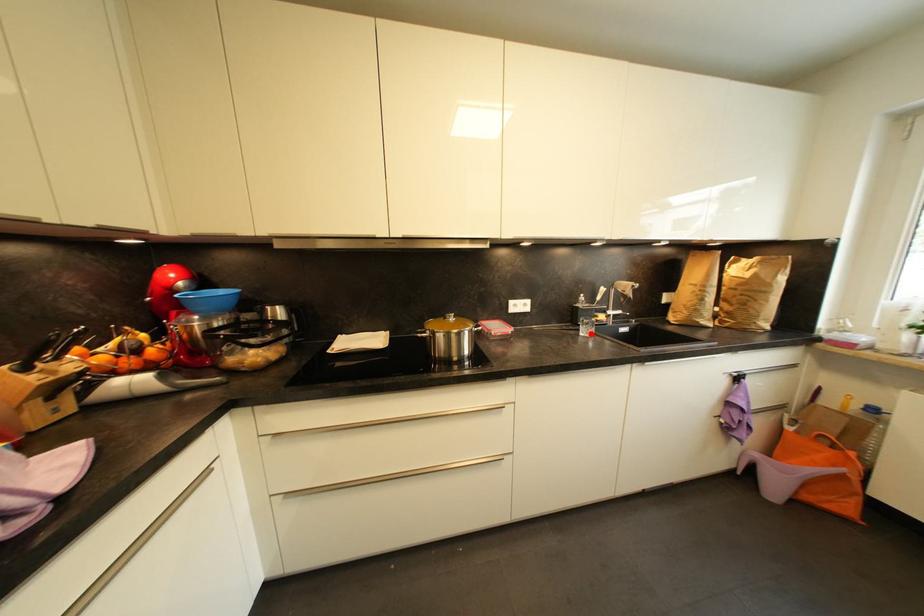
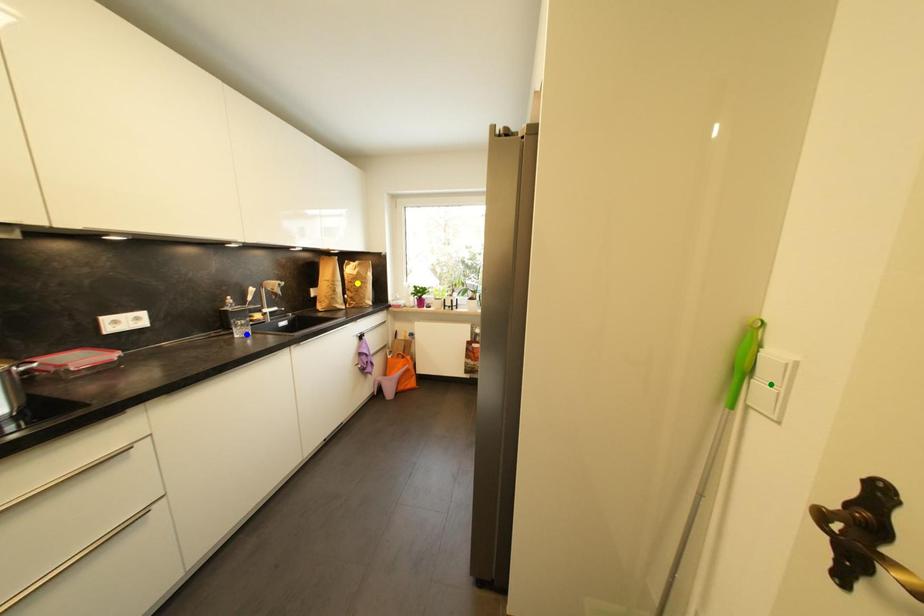
Question: I am providing you with two images of the same scene from different viewpoints. A red point is marked on the first image. You are given multiple points on the second image. Which spot in image 2 lines up with the point in image 1?

Choices:
 (A) green point
 (B) blue point
 (C) yellow point

Answer: (B)